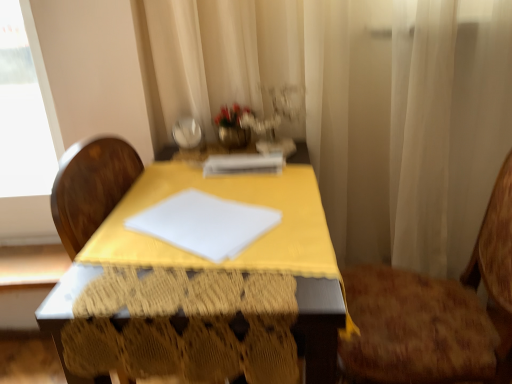
Question: Is white sheer curtain at center bigger or smaller than brown textured chair at right?

Choices:
 (A) big
 (B) small

Answer: (A)

Question: Is point (331, 43) positioned closer to the camera than point (403, 316)?

Choices:
 (A) closer
 (B) farther

Answer: (B)

Question: Considering the real-world distances, which object is closest to the yellow fabric-covered table at center?

Choices:
 (A) white sheer curtain at center
 (B) white paper at center
 (C) brown textured chair at right

Answer: (B)

Question: Based on their relative distances, which object is nearer to the yellow fabric-covered table at center?

Choices:
 (A) brown textured chair at right
 (B) white sheer curtain at center
 (C) white paper at center

Answer: (C)